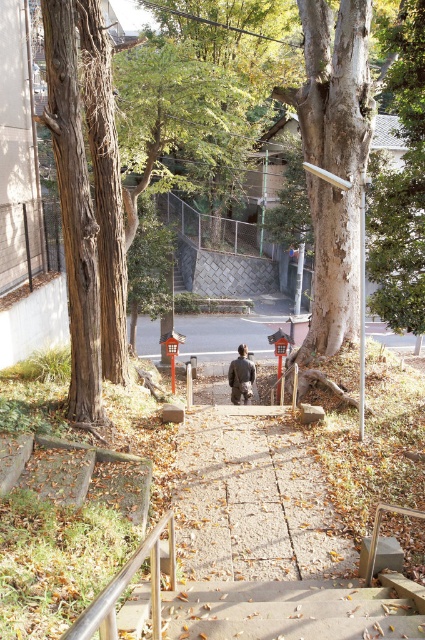
You are a delivery person carrying a heavy package and need to ascend the concrete stairs at center. There is a metallic silver railing at lower left nearby. Can you use the railing to steady yourself while climbing the stairs?

The concrete stairs at center is larger in size than metallic silver railing at lower left, so the railing is smaller and may not provide sufficient support for climbing the stairs.

You are a photographer setting up equipment on the pathway. You need to position your tripod between the metallic silver railing at lower left and the camouflage jacket at center. Which object should you place the tripod closer to if you want to maximize the space available for your setup?

You should place the tripod closer to the metallic silver railing at lower left because it occupies less space than the camouflage jacket at center, allowing more room for the tripod setup.